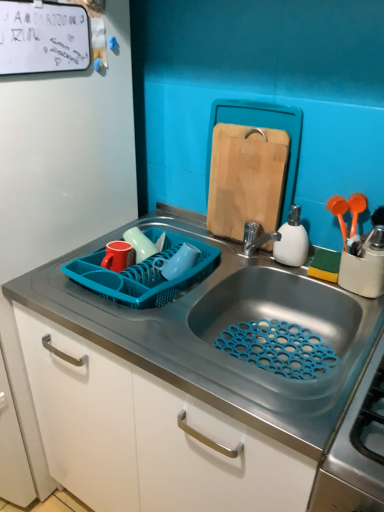
Question: Is blue plastic dish rack at left in front of white matte dry erase board at upper left?

Choices:
 (A) no
 (B) yes

Answer: (B)

Question: Is blue plastic dish rack at left oriented towards white matte dry erase board at upper left?

Choices:
 (A) yes
 (B) no

Answer: (B)

Question: Can you confirm if blue plastic dish rack at left is wider than white matte dry erase board at upper left?

Choices:
 (A) yes
 (B) no

Answer: (A)

Question: From the image's perspective, is blue plastic dish rack at left under white matte dry erase board at upper left?

Choices:
 (A) yes
 (B) no

Answer: (A)

Question: Is blue plastic dish rack at left taller than white matte dry erase board at upper left?

Choices:
 (A) no
 (B) yes

Answer: (B)

Question: From a real-world perspective, is blue plastic dish rack at left below white matte dry erase board at upper left?

Choices:
 (A) no
 (B) yes

Answer: (B)

Question: Is blue plastic dish rack at left aimed at white matte soap dispenser at right?

Choices:
 (A) yes
 (B) no

Answer: (B)

Question: Is white matte soap dispenser at right inside blue plastic dish rack at left?

Choices:
 (A) yes
 (B) no

Answer: (B)

Question: From a real-world perspective, is blue plastic dish rack at left located beneath white matte soap dispenser at right?

Choices:
 (A) yes
 (B) no

Answer: (A)

Question: From the image's perspective, is blue plastic dish rack at left beneath white matte soap dispenser at right?

Choices:
 (A) no
 (B) yes

Answer: (B)

Question: Is blue plastic dish rack at left smaller than white matte soap dispenser at right?

Choices:
 (A) no
 (B) yes

Answer: (A)

Question: Considering the relative sizes of blue plastic dish rack at left and white matte soap dispenser at right in the image provided, is blue plastic dish rack at left bigger than white matte soap dispenser at right?

Choices:
 (A) yes
 (B) no

Answer: (A)

Question: Does blue plastic dish rack at left have a greater height compared to wooden cutting board at upper center?

Choices:
 (A) no
 (B) yes

Answer: (B)